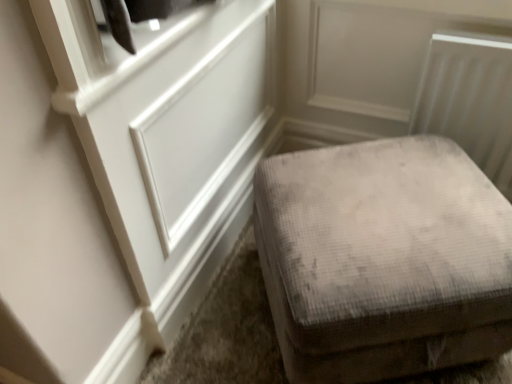
Question: Looking at the image, does gray velvety ottoman at lower right seem bigger or smaller compared to white paneling at upper left?

Choices:
 (A) small
 (B) big

Answer: (B)

Question: Considering the positions of point tap(289, 231) and point tap(187, 168), is point tap(289, 231) closer or farther from the camera than point tap(187, 168)?

Choices:
 (A) closer
 (B) farther

Answer: (A)

Question: Considering the positions of gray velvety ottoman at lower right and white paneling at upper left in the image, is gray velvety ottoman at lower right wider or thinner than white paneling at upper left?

Choices:
 (A) wide
 (B) thin

Answer: (A)

Question: Considering the relative positions of white paneling at upper left and gray velvety ottoman at lower right in the image provided, is white paneling at upper left to the left or to the right of gray velvety ottoman at lower right?

Choices:
 (A) right
 (B) left

Answer: (B)

Question: From the image's perspective, is white paneling at upper left positioned above or below gray velvety ottoman at lower right?

Choices:
 (A) above
 (B) below

Answer: (A)

Question: Is white paneling at upper left bigger or smaller than gray velvety ottoman at lower right?

Choices:
 (A) big
 (B) small

Answer: (B)

Question: From a real-world perspective, is white paneling at upper left physically located above or below gray velvety ottoman at lower right?

Choices:
 (A) above
 (B) below

Answer: (A)